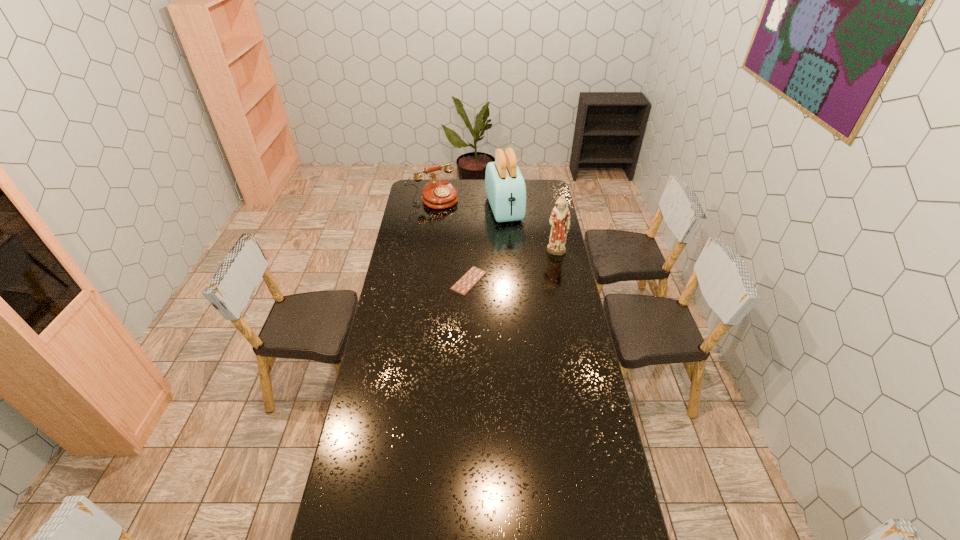
Identify the location of free space between the toaster and the chocolate bar. (487, 245).

Where is `vacant region between the nearest object and the toaster`? This screenshot has height=540, width=960. vacant region between the nearest object and the toaster is located at coordinates (487, 245).

I want to click on free area in between the shortest object and the second nearest object, so click(513, 267).

At what (x,y) coordinates should I click in order to perform the action: click on vacant space that is in between the toaster and the third tallest object. Please return your answer as a coordinate pair (x, y). Looking at the image, I should click on (468, 204).

At what (x,y) coordinates should I click in order to perform the action: click on object that stands as the second closest to the toaster. Please return your answer as a coordinate pair (x, y). The image size is (960, 540). Looking at the image, I should click on (559, 220).

Locate which object ranks second in proximity to the shortest object. Please provide its 2D coordinates. Your answer should be formatted as a tuple, i.e. [(x, y)], where the tuple contains the x and y coordinates of a point satisfying the conditions above.

[(505, 187)]

You are a GUI agent. You are given a task and a screenshot of the screen. Output one action in this format:
    pyautogui.click(x=<x>, y=<y>)
    Task: Click on the free spot that satisfies the following two spatial constraints: 1. on the front side of the third tallest object; 2. on the left side of the shortest object
    This screenshot has height=540, width=960.
    Given the screenshot: What is the action you would take?
    pyautogui.click(x=420, y=281)

Find the location of a particular element. The image size is (960, 540). vacant region that satisfies the following two spatial constraints: 1. on the back side of the nearest object; 2. on the right side of the toaster is located at coordinates (471, 209).